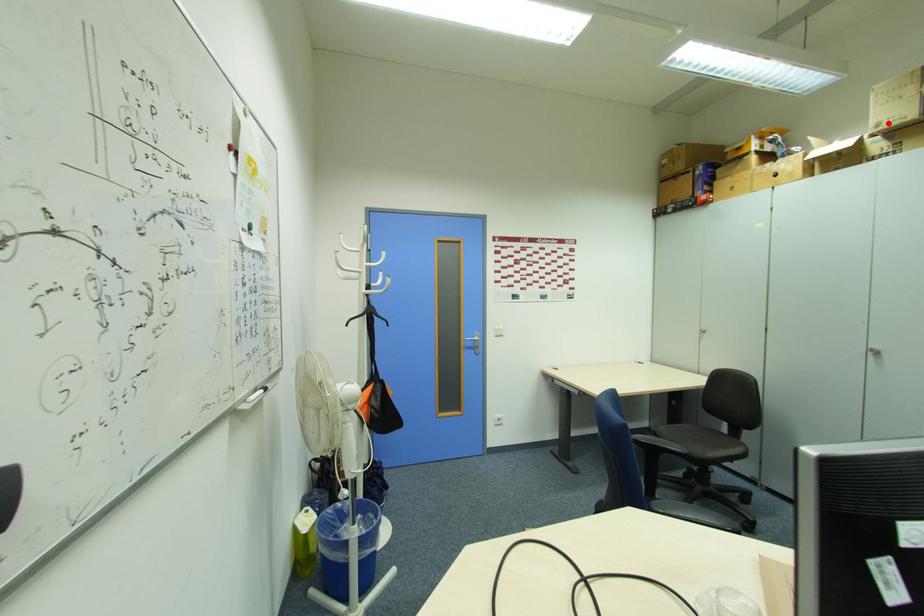
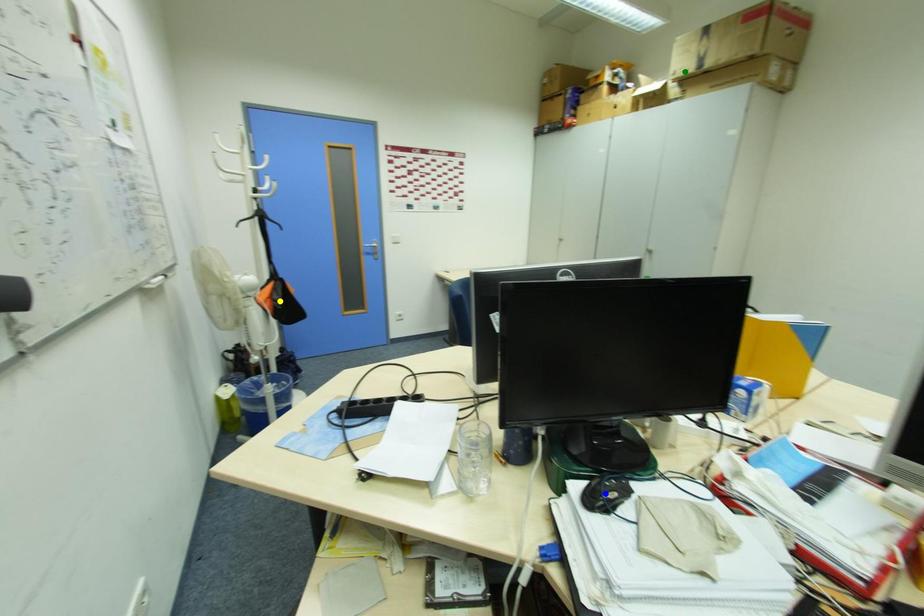
Question: I am providing you with two images of the same scene from different viewpoints. A red point is marked on the first image. You are given multiple points on the second image. Can you choose the point in image 2 that corresponds to the point in image 1?

Choices:
 (A) yellow point
 (B) blue point
 (C) green point

Answer: (C)